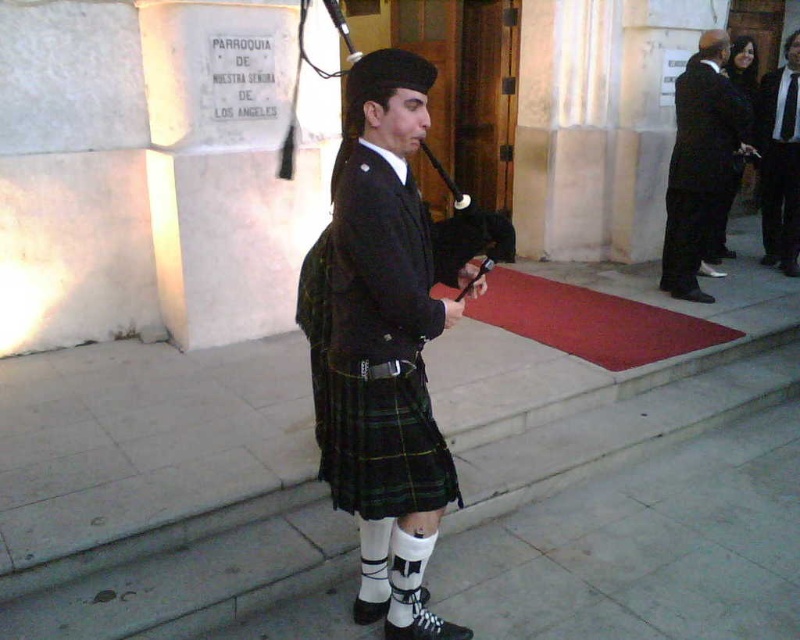
Question: Does black woolen kilt at center appear over black satin suit at upper right?

Choices:
 (A) yes
 (B) no

Answer: (B)

Question: Which object is closer to the camera taking this photo?

Choices:
 (A) smooth stone pavement at center
 (B) black leather bagpipe at center
 (C) black woolen kilt at center
 (D) black satin suit at upper right

Answer: (C)

Question: Estimate the real-world distances between objects in this image. Which object is farther from the black leather bagpipe at center?

Choices:
 (A) black wool suit at right
 (B) black woolen kilt at center
 (C) smooth stone pavement at center
 (D) black satin suit at upper right

Answer: (A)

Question: Does black plaid kilt at center lie behind black satin suit at upper right?

Choices:
 (A) yes
 (B) no

Answer: (B)

Question: Which object is farther from the camera taking this photo?

Choices:
 (A) smooth stone pavement at center
 (B) black plaid kilt at center
 (C) black leather bagpipe at center
 (D) black satin suit at upper right

Answer: (D)

Question: Is black satin suit at upper right below black wool suit at right?

Choices:
 (A) no
 (B) yes

Answer: (B)